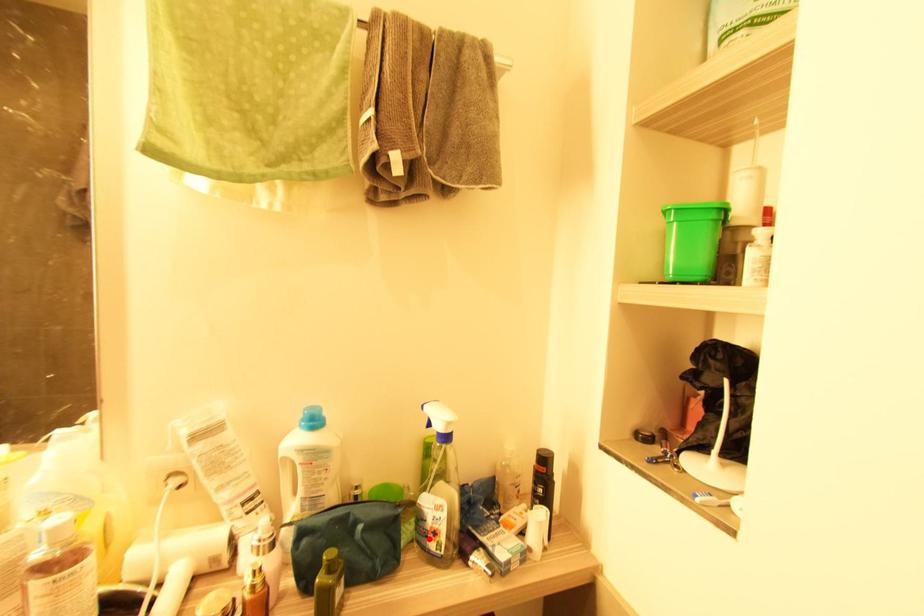
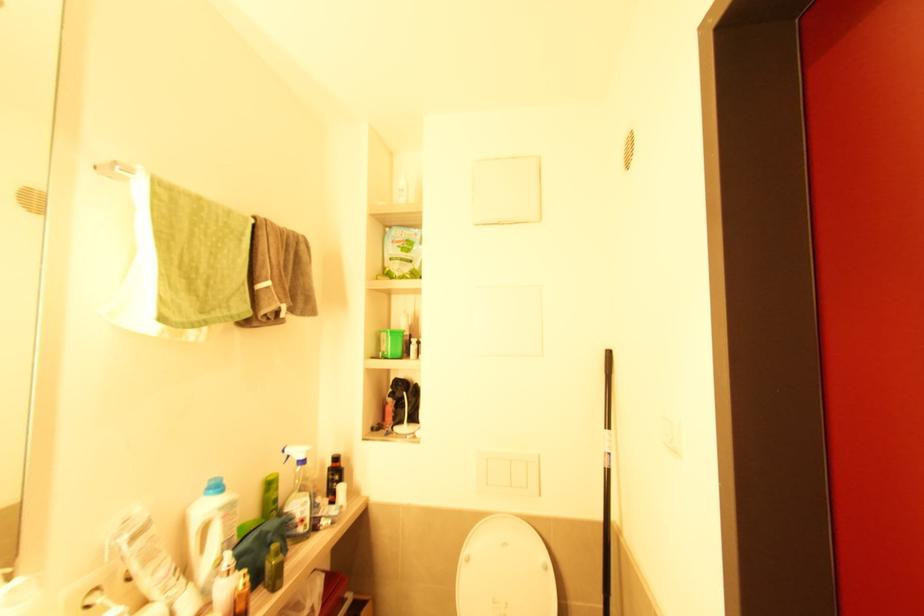
Where in the second image is the point corresponding to the highlighted location from the first image?

(298, 527)